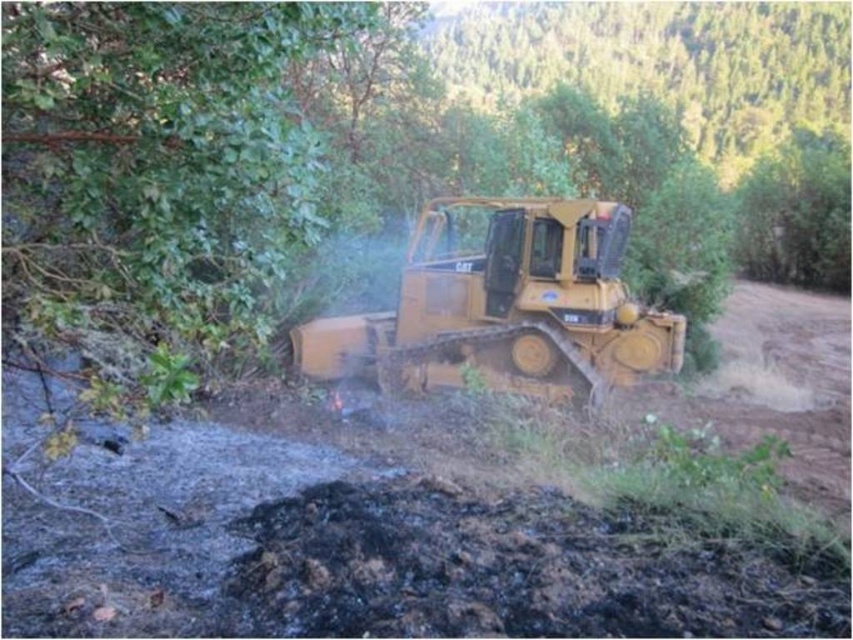
From the picture: You are a construction worker tasked with avoiding areas of burnt soil to prevent equipment damage. The bulldozer needs to move from its current position to a safer area. Based on the scene, which direction should you move the bulldozer to avoid the charcoal soil at lower center?

The charcoal soil at lower center is located at point (506,572), so you should move the bulldozer away from that coordinate to avoid the burnt area.

You are operating a bulldozer in the forested area shown. You need to move from your current position to a safe location. There are two points marked on your GPS. The first point is at coordinates point [753,563] and the second is at point [381,378]. Which point should you head towards if you want to go in the direction that is closest to the bulldozer?

Point [753,563] is in front of point [381,378], so you should head towards point [753,563] to go in the direction closest to the bulldozer.